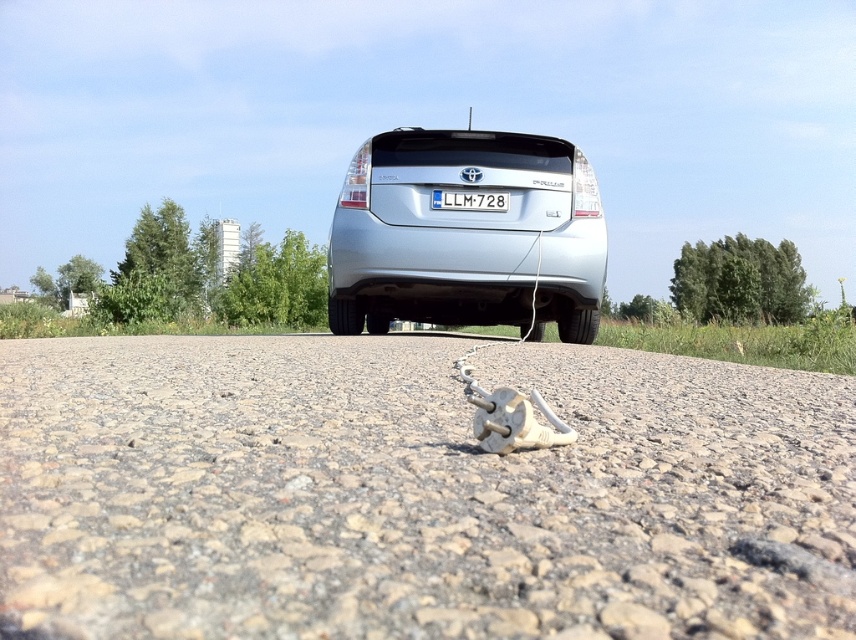
Question: Is gray gravel at center above white plastic license plate at center?

Choices:
 (A) no
 (B) yes

Answer: (A)

Question: Which of the following is the closest to the observer?

Choices:
 (A) silver metallic car at center
 (B) gray gravel at center
 (C) white plastic license plate at center

Answer: (B)

Question: Does gray gravel at center appear under silver metallic car at center?

Choices:
 (A) no
 (B) yes

Answer: (B)

Question: Which point is closer to the camera taking this photo?

Choices:
 (A) (434, 196)
 (B) (369, 490)

Answer: (B)

Question: Does gray gravel at center have a lesser width compared to white plastic license plate at center?

Choices:
 (A) no
 (B) yes

Answer: (A)

Question: Which point is farther from the camera taking this photo?

Choices:
 (A) (601, 420)
 (B) (373, 138)

Answer: (B)